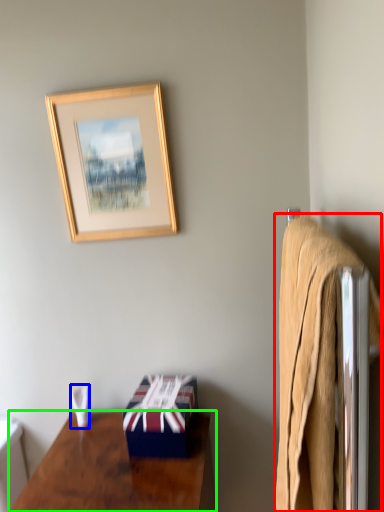
Question: Considering the real-world distances, which object is farthest from bath towel (highlighted by a red box)? towel/napkin (highlighted by a blue box) or desk (highlighted by a green box)?

Choices:
 (A) towel/napkin
 (B) desk

Answer: (A)